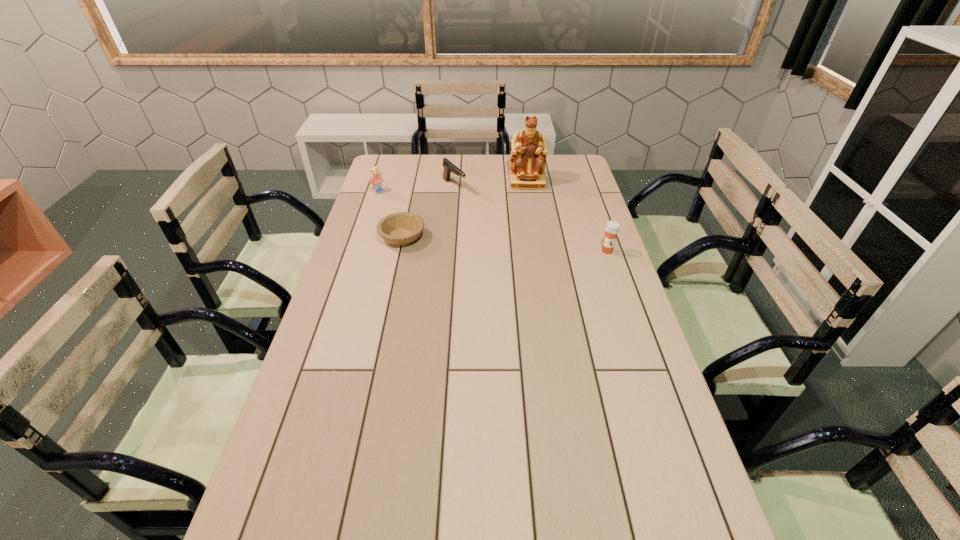
You are a GUI agent. You are given a task and a screenshot of the screen. Output one action in this format:
    pyautogui.click(x=<x>, y=<y>)
    Task: Click on the empty space between the rightmost object and the Lego
    The image size is (960, 540).
    Given the screenshot: What is the action you would take?
    pyautogui.click(x=492, y=221)

Find the location of a particular element. This screenshot has width=960, height=540. empty space that is in between the third object from right to left and the rightmost object is located at coordinates (531, 219).

At what (x,y) coordinates should I click in order to perform the action: click on empty space between the third object from left to right and the second object from right to left. Please return your answer as a coordinate pair (x, y). Looking at the image, I should click on (491, 185).

Where is `empty location between the second object from right to left and the pistol`? empty location between the second object from right to left and the pistol is located at coordinates (491, 185).

Where is `free space that is in between the shortest object and the pistol`? The width and height of the screenshot is (960, 540). free space that is in between the shortest object and the pistol is located at coordinates (428, 212).

Image resolution: width=960 pixels, height=540 pixels. Identify the location of free space between the leftmost object and the pistol. (417, 189).

Locate which object is the fourth closest to the third object from right to left. Please provide its 2D coordinates. Your answer should be formatted as a tuple, i.e. [(x, y)], where the tuple contains the x and y coordinates of a point satisfying the conditions above.

[(612, 228)]

Where is `object that ranks as the third closest to the third object from left to right`? This screenshot has height=540, width=960. object that ranks as the third closest to the third object from left to right is located at coordinates (375, 180).

What are the coordinates of `vacant space that satisfies the following two spatial constraints: 1. on the back side of the second object from right to left; 2. on the right side of the leftmost object` in the screenshot? It's located at (381, 183).

Locate an element on the screen. The image size is (960, 540). free space in the image that satisfies the following two spatial constraints: 1. on the back side of the tallest object; 2. on the right side of the leftmost object is located at coordinates (381, 183).